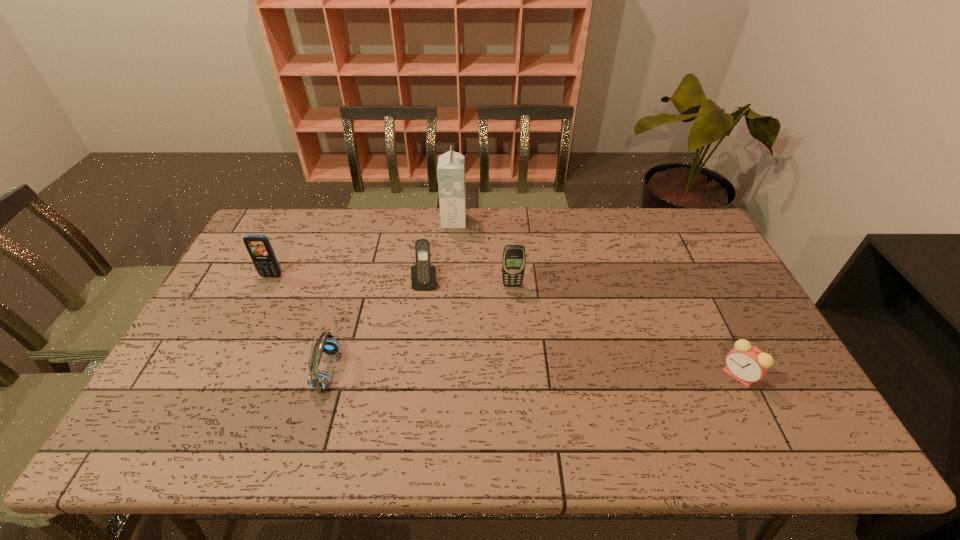
Locate an element on the screen. The image size is (960, 540). free spot that satisfies the following two spatial constraints: 1. on the screen of the fifth object from left to right; 2. on the ear cups of the fifth object from right to left is located at coordinates (518, 369).